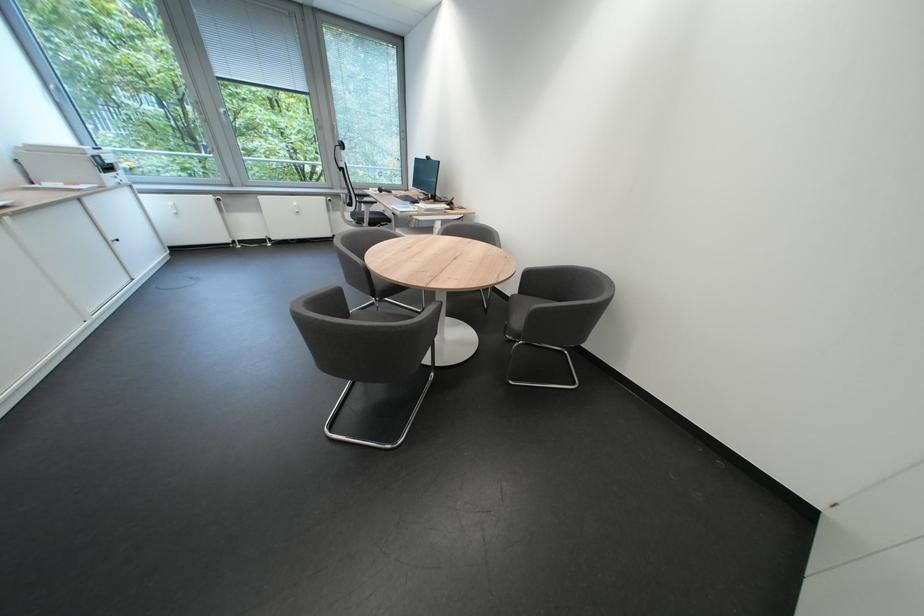
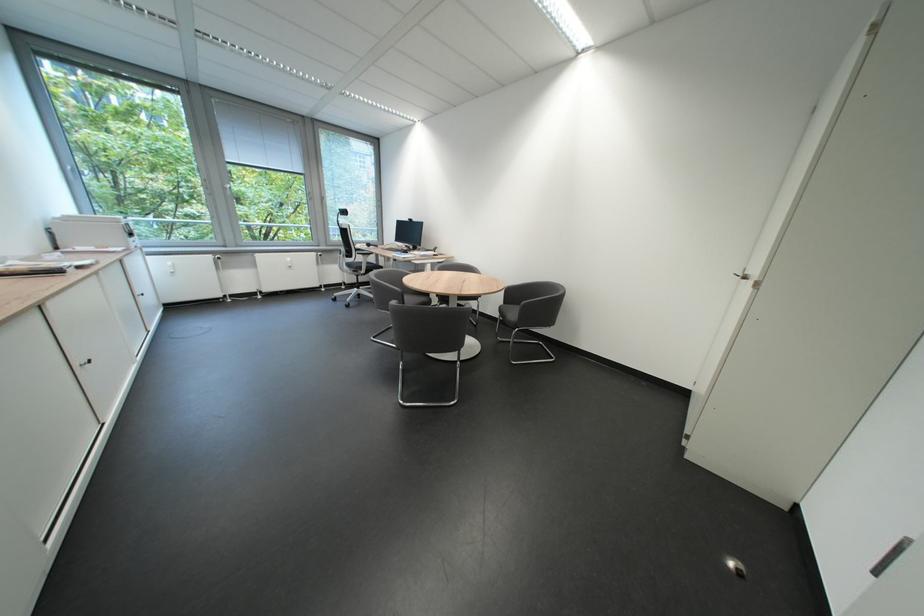
Question: How did the camera likely rotate?

Choices:
 (A) Left
 (B) Right
 (C) Up
 (D) Down

Answer: (B)